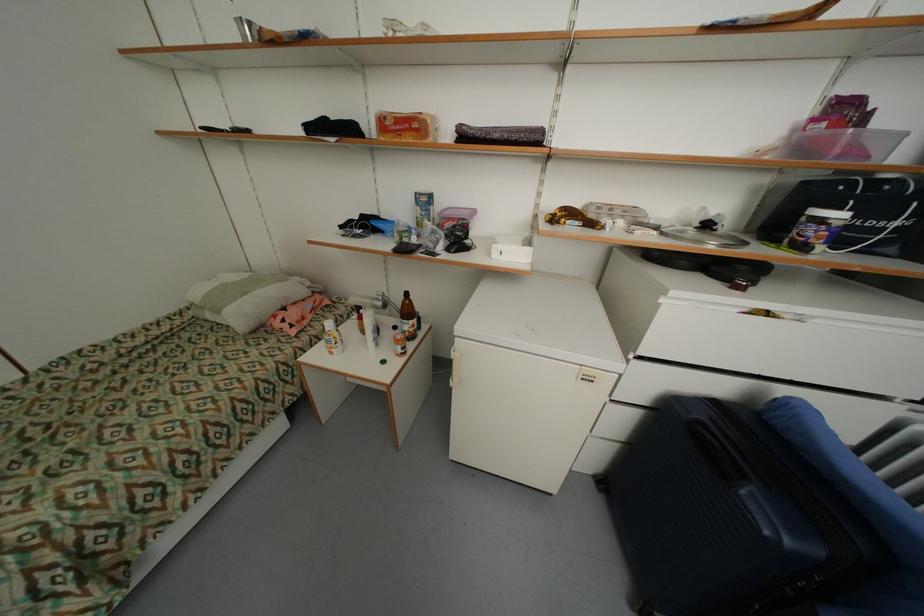
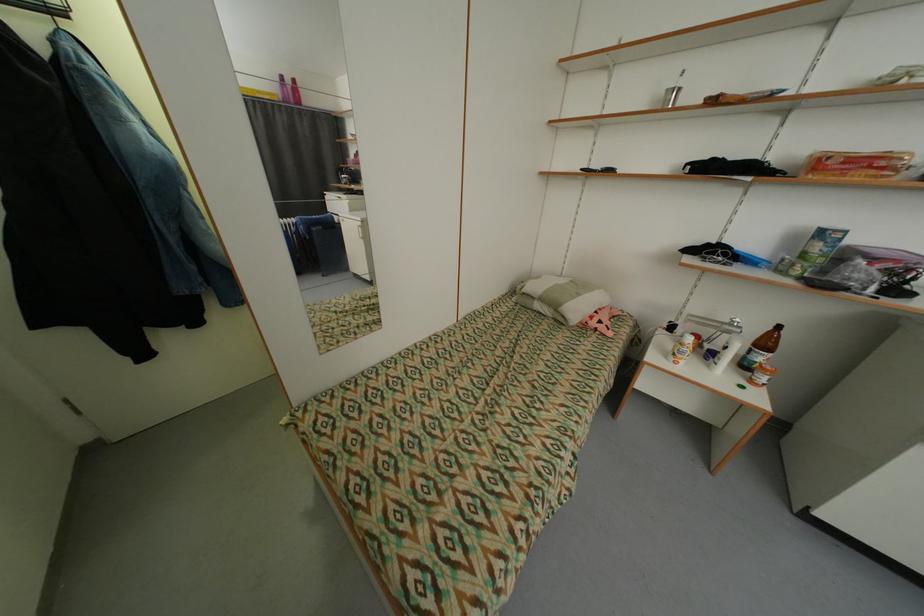
Locate, in the second image, the point that corresponds to (284,325) in the first image.

(600, 323)